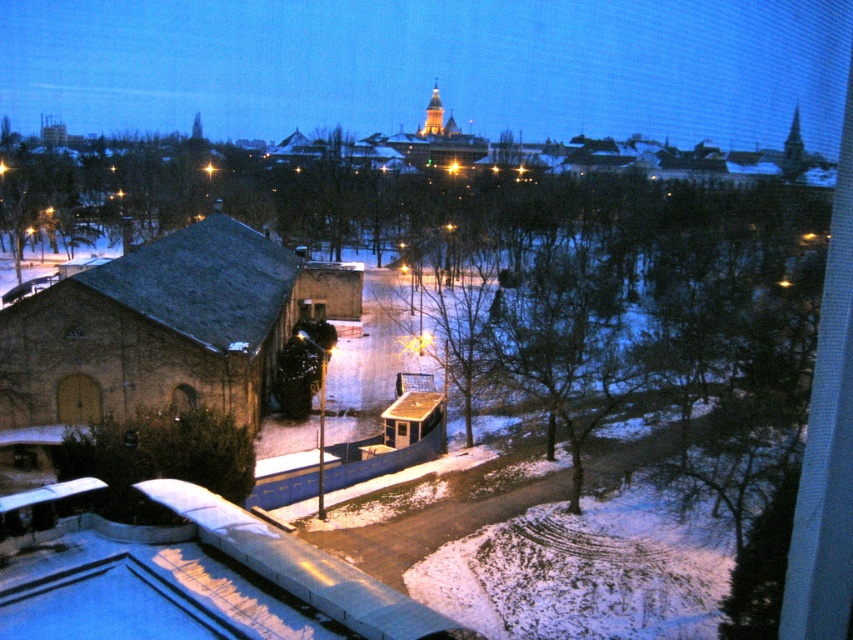
You are standing at the center of the image and want to find the brown stone church at left. In which direction should you look to locate it?

You should look to the left to locate the brown stone church at left as it is positioned at point [165,324].

You are standing at the origin point looking towards the image. Which of the two points, point (x=280, y=264) or point (x=74, y=404), is farther away from you?

Point (x=280, y=264) is behind point (x=74, y=404), so it is farther away from you.

You are standing at the wooden door at lower left and want to enter the brown stone church at left. Is the church directly in front of you?

Yes, the brown stone church at left is directly in front of the wooden door at lower left, so it is directly in front of you.